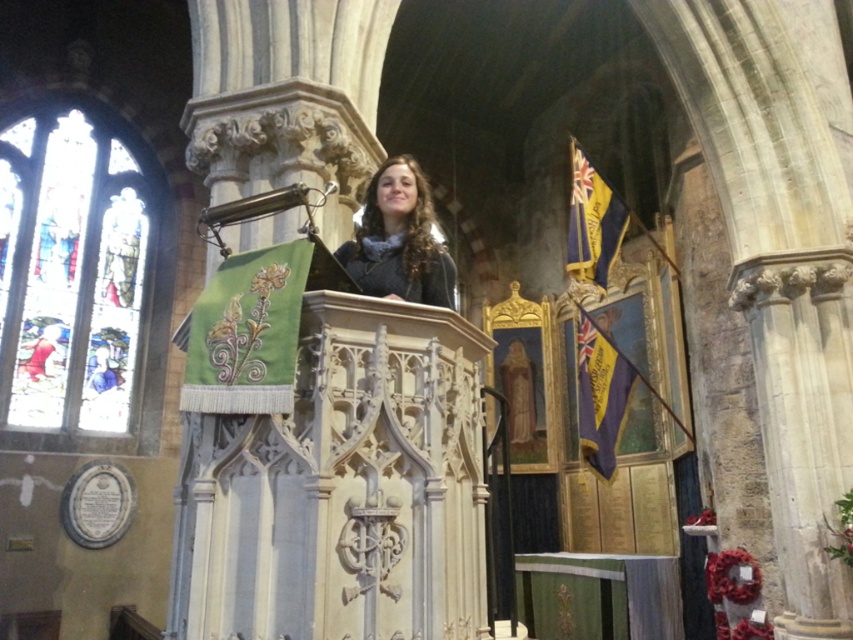
Does stained glass window at left have a greater width compared to gray wool scarf at center?

Yes, stained glass window at left is wider than gray wool scarf at center.

Who is more forward, (44, 268) or (439, 262)?

Point (439, 262)

Between point (53, 228) and point (405, 272), which one is positioned behind?

Positioned behind is point (53, 228).

The height and width of the screenshot is (640, 853). In order to click on stained glass window at left in this screenshot , I will do coord(68,273).